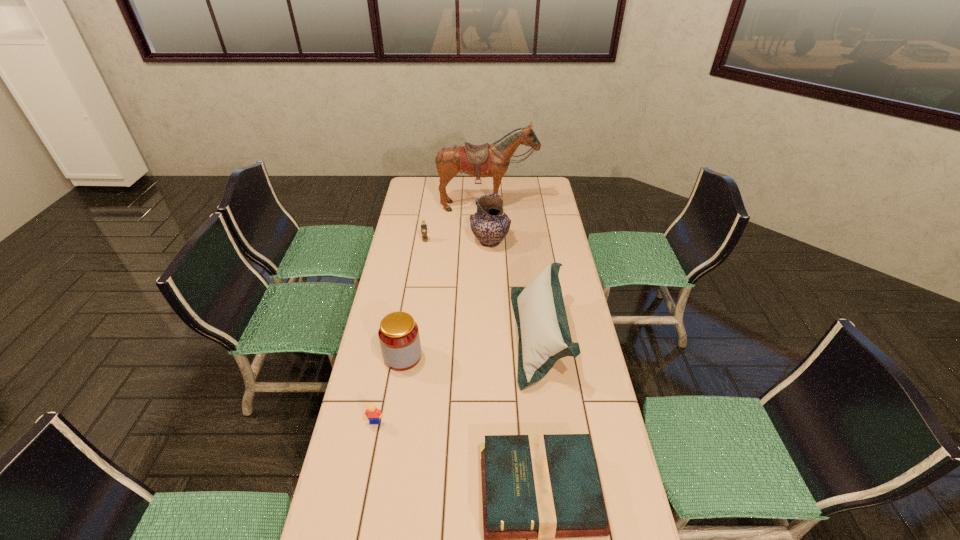
The width and height of the screenshot is (960, 540). In order to click on free space at the far edge in this screenshot , I will do `click(484, 192)`.

This screenshot has width=960, height=540. Find the location of `blank space at the left edge of the desktop`. blank space at the left edge of the desktop is located at coordinates (428, 211).

Where is `free space at the right edge of the desktop`? The width and height of the screenshot is (960, 540). free space at the right edge of the desktop is located at coordinates 578,334.

Where is `vacant area at the far left corner`? vacant area at the far left corner is located at coordinates (x=433, y=185).

Image resolution: width=960 pixels, height=540 pixels. I want to click on vacant region at the far right corner, so click(x=548, y=198).

Where is `unoccupied position between the cushion and the Lego`? This screenshot has height=540, width=960. unoccupied position between the cushion and the Lego is located at coordinates (457, 379).

Locate an element on the screen. The image size is (960, 540). free space between the soda and the jar is located at coordinates (414, 299).

The image size is (960, 540). In order to click on vacant point located between the farthest object and the soda in this screenshot , I will do `click(456, 224)`.

I want to click on free space between the cushion and the saddle, so click(514, 272).

Locate an element on the screen. The width and height of the screenshot is (960, 540). object that is the closest to the jar is located at coordinates (373, 414).